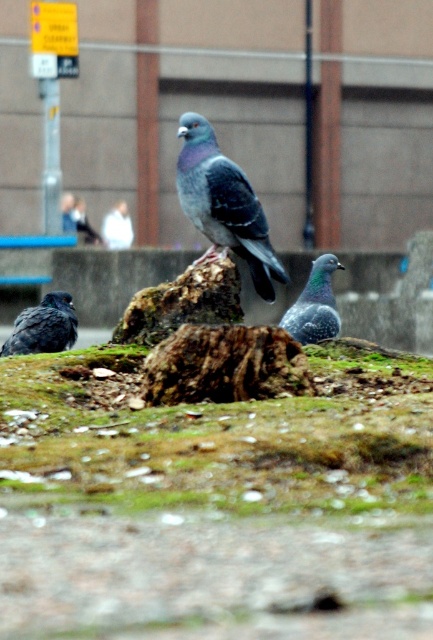
Question: Among these points, which one is farthest from the camera?

Choices:
 (A) (74, 321)
 (B) (184, 296)
 (C) (116, 387)

Answer: (A)

Question: From the image, what is the correct spatial relationship of blue-gray feathered pigeon at center in relation to mossy rock at center?

Choices:
 (A) left
 (B) right

Answer: (B)

Question: Can you confirm if green mossy ground at center is positioned below matte gray pigeon at lower left?

Choices:
 (A) no
 (B) yes

Answer: (B)

Question: Which of the following is the closest to the observer?

Choices:
 (A) (329, 321)
 (B) (23, 312)
 (C) (371, 404)

Answer: (C)

Question: Considering the real-world distances, which object is closest to the mossy rock at center?

Choices:
 (A) matte gray pigeon at lower left
 (B) gray matte pigeon at center

Answer: (B)

Question: Considering the relative positions of green mossy ground at center and gray matte pigeon at center in the image provided, where is green mossy ground at center located with respect to gray matte pigeon at center?

Choices:
 (A) above
 (B) below

Answer: (B)